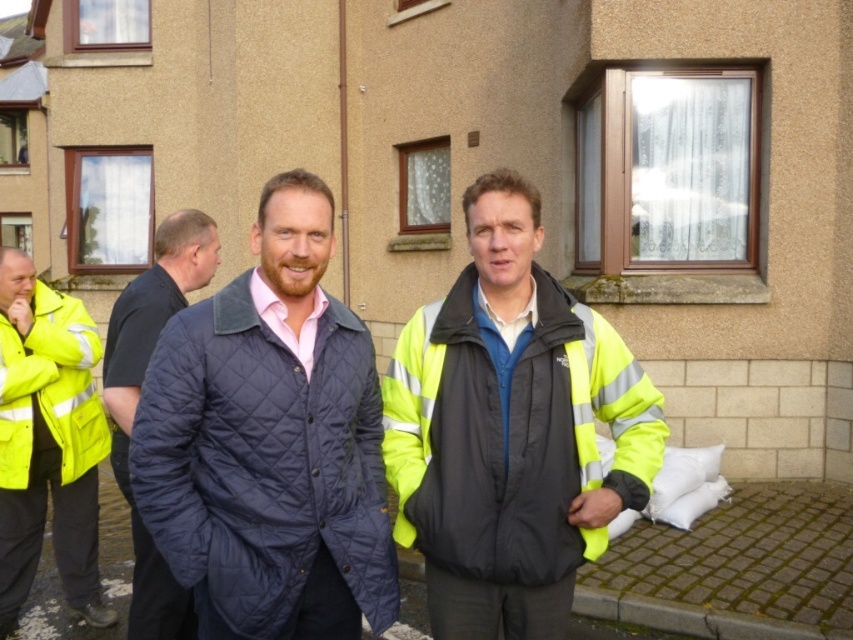
You are a photographer trying to capture both the yellow reflective jacket at left and the dark blue quilted jacket at left in a single shot. Which jacket will appear closer to the camera in the photo?

The yellow reflective jacket at left will appear closer to the camera because it is positioned further to the viewer than the dark blue quilted jacket at left.

You are a pedestrian trying to cross the street and see two men ahead. One is wearing a high visibility fabric jacket at center and the other is wearing a yellow reflective jacket at left. Which man is closer to you?

The high visibility fabric jacket at center is closer to the viewer than the yellow reflective jacket at left, so the man wearing the high visibility fabric jacket at center is closer to you.

You are a photographer trying to capture both the yellow reflective jacket at left and the dark blue quilted jacket at left in a single frame. Which jacket will appear larger in the photo?

The yellow reflective jacket at left will appear larger in the photo because it is bigger than the dark blue quilted jacket at left.